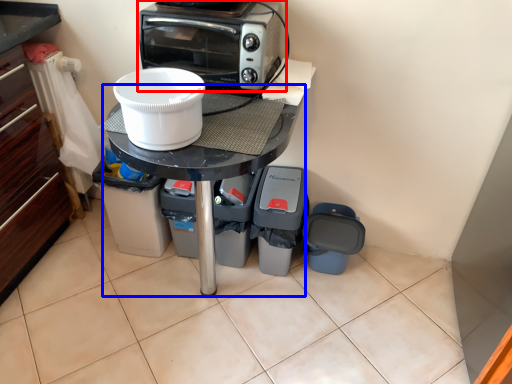
Question: Which object is closer to the camera taking this photo, kitchen appliance (highlighted by a red box) or table (highlighted by a blue box)?

Choices:
 (A) kitchen appliance
 (B) table

Answer: (B)